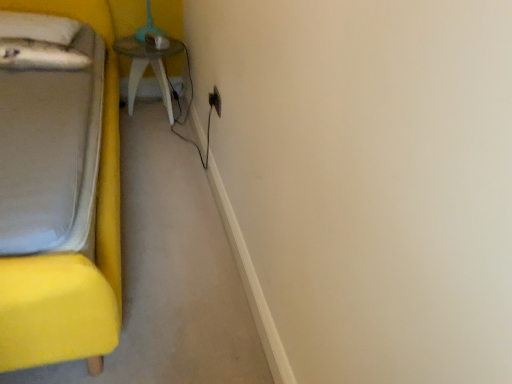
Question: Considering the positions of white soft pillow at upper left and black plastic electric outlet at upper center in the image, is white soft pillow at upper left wider or thinner than black plastic electric outlet at upper center?

Choices:
 (A) wide
 (B) thin

Answer: (A)

Question: Considering the positions of point tap(41, 21) and point tap(217, 107), is point tap(41, 21) closer or farther from the camera than point tap(217, 107)?

Choices:
 (A) farther
 (B) closer

Answer: (A)

Question: Which is nearer to the black plastic electric outlet at upper center?

Choices:
 (A) white soft pillow at upper left
 (B) yellow fabric bed at left
 (C) wooden table at center

Answer: (C)

Question: Which is farther from the wooden table at center?

Choices:
 (A) yellow fabric bed at left
 (B) black plastic electric outlet at upper center
 (C) white soft pillow at upper left

Answer: (A)